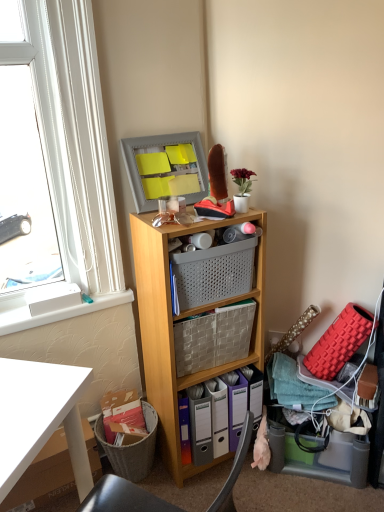
Question: From a real-world perspective, relative to white plastic window at upper left, is woven fabric basket at center, positioned as the second basket in top-to-bottom order, vertically above or below?

Choices:
 (A) above
 (B) below

Answer: (B)

Question: In terms of width, does woven fabric basket at center, positioned as the second basket in top-to-bottom order, look wider or thinner when compared to white plastic window at upper left?

Choices:
 (A) thin
 (B) wide

Answer: (B)

Question: Which of these objects is positioned closest to the wooden shelf at center?

Choices:
 (A) white plastic window at upper left
 (B) woven fabric basket at center, positioned as the second basket in top-to-bottom order
 (C) white cardboard box at lower left
 (D) white plastic window sill at upper left
 (E) translucent plastic storage box at lower right

Answer: (B)

Question: Based on their relative distances, which object is farther from the white plastic window sill at upper left?

Choices:
 (A) white cardboard box at lower left
 (B) gray perforated basket at center, which appears as the first basket when viewed from the top
 (C) woven fabric basket at center, positioned as the second basket in top-to-bottom order
 (D) wooden shelf at center
 (E) translucent plastic storage box at lower right

Answer: (E)